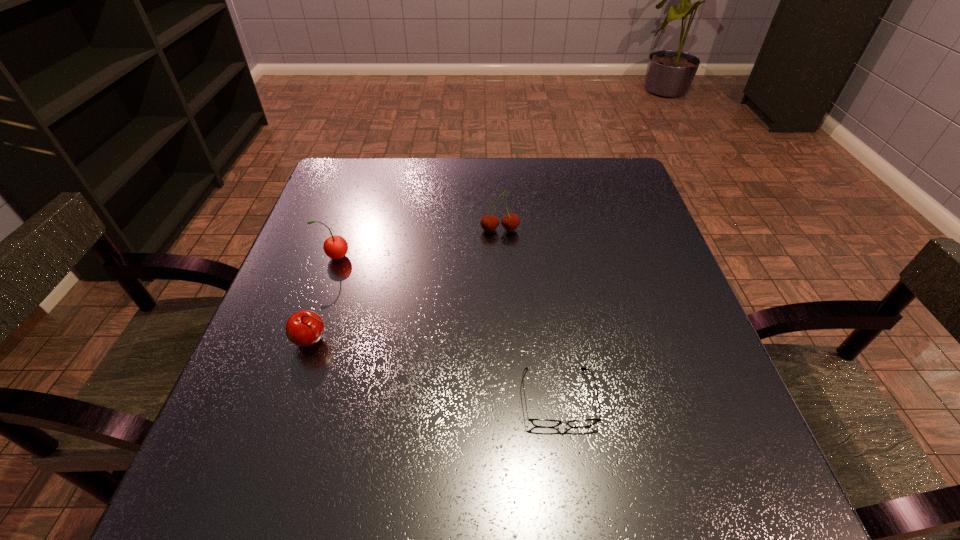
This screenshot has height=540, width=960. What are the coordinates of `free space between the farthest object and the nearest cherry` in the screenshot? It's located at (406, 286).

The image size is (960, 540). I want to click on empty space that is in between the shortest object and the rightmost cherry, so click(529, 314).

Where is `free space between the spectacles and the shortest cherry`? The width and height of the screenshot is (960, 540). free space between the spectacles and the shortest cherry is located at coordinates (436, 369).

This screenshot has width=960, height=540. Identify the location of free space between the nearest object and the second nearest object. (436, 369).

Find the location of a particular element. object that is the closest to the nearest cherry is located at coordinates (335, 247).

Find the location of a particular element. the second closest object to the second nearest object is located at coordinates (543, 423).

At what (x,y) coordinates should I click in order to perform the action: click on cherry that stands as the closest to the shortest cherry. Please return your answer as a coordinate pair (x, y). The height and width of the screenshot is (540, 960). Looking at the image, I should click on (335, 247).

Locate an element on the screen. cherry object that ranks as the second closest to the shortest object is located at coordinates (489, 223).